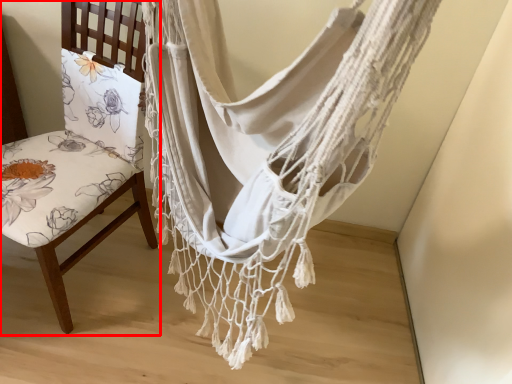
Question: From the image, what is the correct spatial relationship of chair (annotated by the red box) in relation to curtain?

Choices:
 (A) left
 (B) right

Answer: (A)